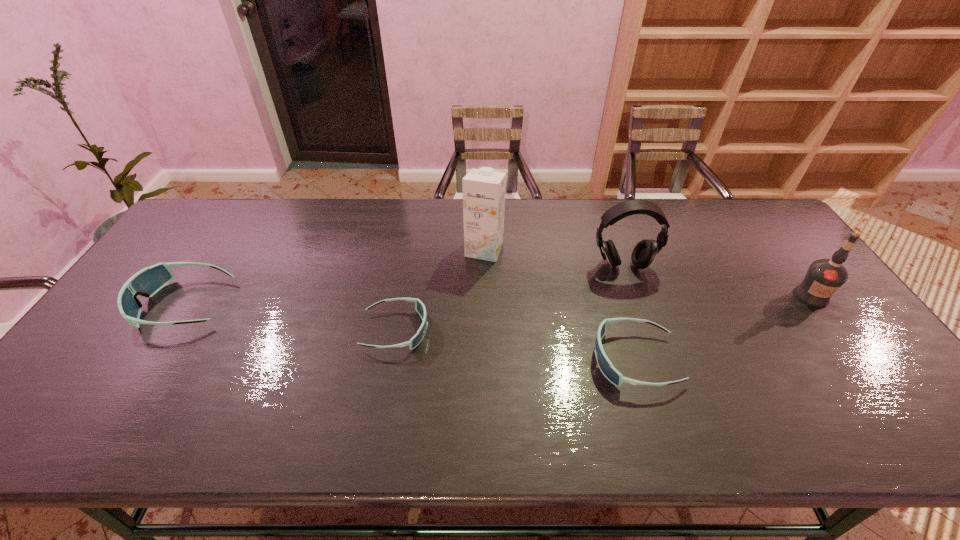
This screenshot has height=540, width=960. Find the location of `vacant position in the image that satisfies the following two spatial constraints: 1. on the ear cups of the earphone; 2. on the front-facing side of the shortest goggles`. vacant position in the image that satisfies the following two spatial constraints: 1. on the ear cups of the earphone; 2. on the front-facing side of the shortest goggles is located at coordinates (645, 330).